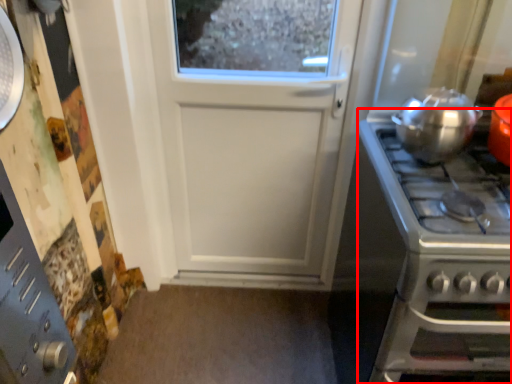
Question: From the image's perspective, where is gas stove (annotated by the red box) located relative to kitchen appliance?

Choices:
 (A) above
 (B) below

Answer: (B)